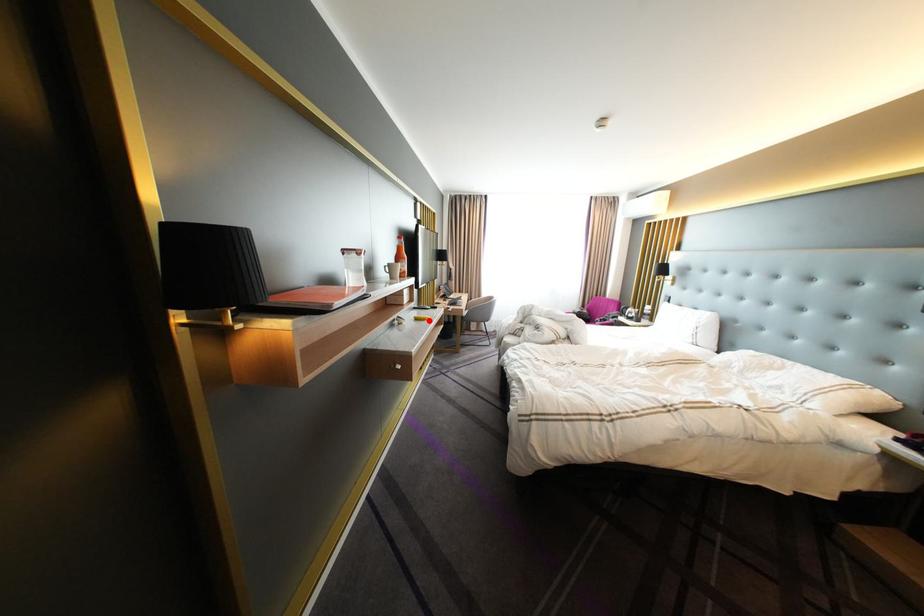
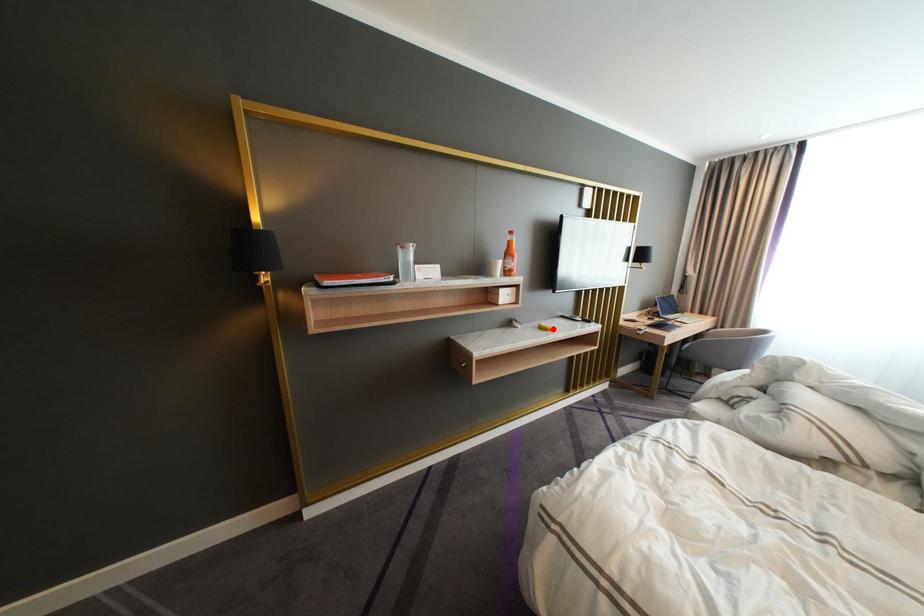
I am providing you with two images of the same scene from different viewpoints. A red point is marked on the first image and another point is marked on the second image. Are the points marked in image1 and image2 representing the same 3D position?

Yes